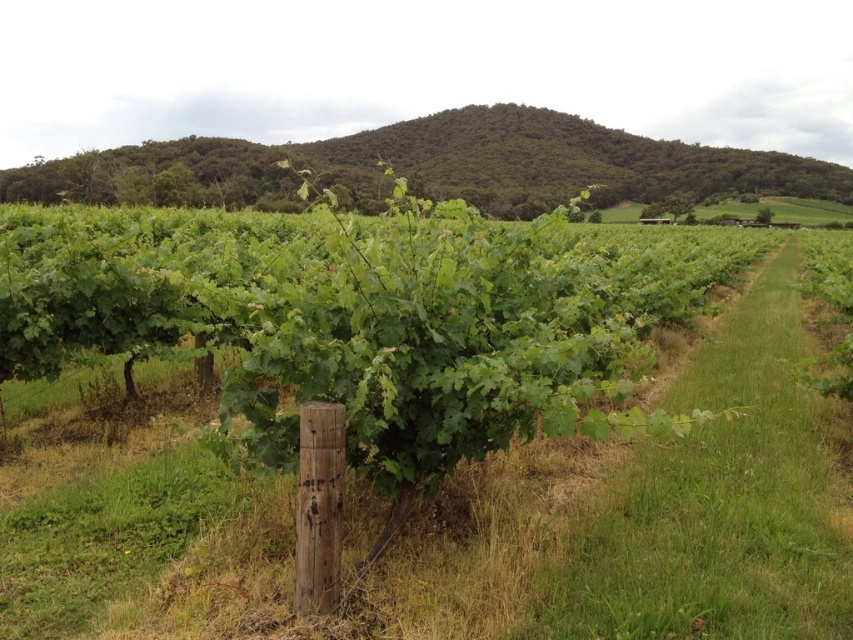
Between green leafy vines at center and green leafy hillside at upper center, which one appears on the left side from the viewer's perspective?

green leafy vines at center

Is point (199, 625) positioned in front of point (520, 134)?

That is True.

This screenshot has height=640, width=853. In order to click on green leafy vines at center in this screenshot , I will do `click(473, 518)`.